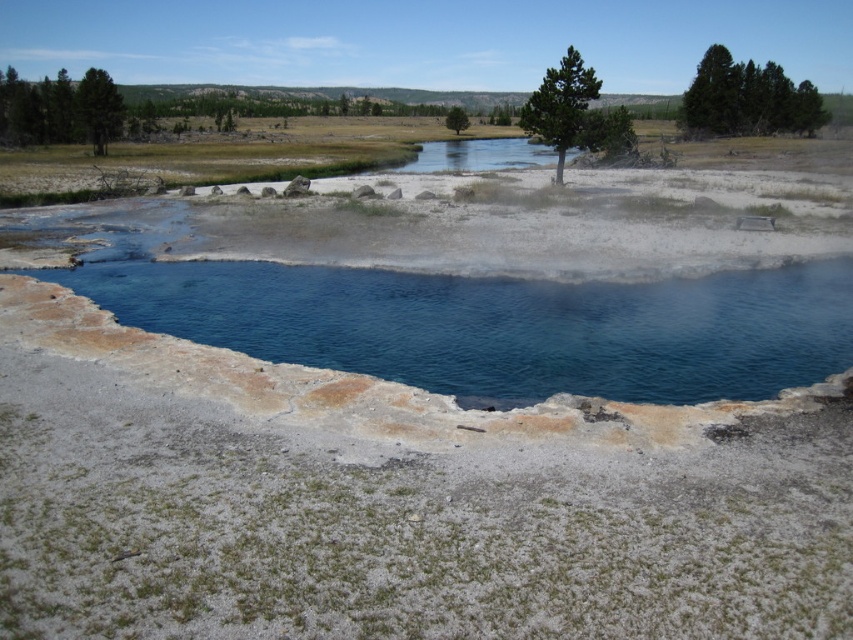
Based on the photo, is green coniferous trees at upper right to the left of green leafy tree at center from the viewer's perspective?

In fact, green coniferous trees at upper right is to the right of green leafy tree at center.

Can you confirm if green coniferous trees at upper right is positioned to the right of green leafy tree at center?

Yes, green coniferous trees at upper right is to the right of green leafy tree at center.

Find the location of a particular element. Image resolution: width=853 pixels, height=640 pixels. green coniferous trees at upper right is located at coordinates (747, 99).

In the scene shown: Who is more distant from viewer, (587, 67) or (90, 136)?

Positioned behind is point (90, 136).

Can you confirm if green textured pine tree at upper right is taller than green textured tree at upper left?

Indeed, green textured pine tree at upper right has a greater height compared to green textured tree at upper left.

Which is behind, point (572, 68) or point (100, 138)?

Point (100, 138)

Locate an element on the screen. This screenshot has width=853, height=640. green textured pine tree at upper right is located at coordinates coord(560,104).

Which is below, green textured pine tree at upper right or green leafy tree at center?

green leafy tree at center

Based on the photo, which of these two, green textured pine tree at upper right or green leafy tree at center, stands taller?

green textured pine tree at upper right

What do you see at coordinates (560, 104) in the screenshot? This screenshot has width=853, height=640. I see `green textured pine tree at upper right` at bounding box center [560, 104].

Identify the location of green textured pine tree at upper right. The height and width of the screenshot is (640, 853). (560, 104).